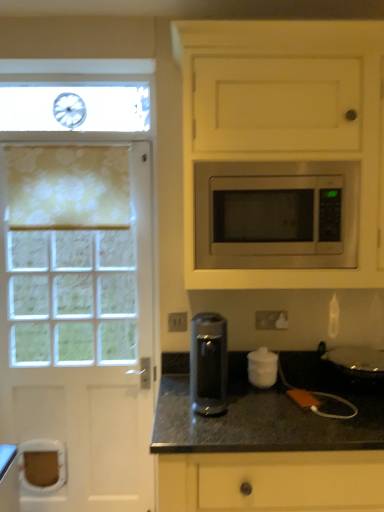
Question: From the image's perspective, is sleek metallic coffee maker at center on top of white matte sugar container at center?

Choices:
 (A) yes
 (B) no

Answer: (A)

Question: Considering the relative sizes of sleek metallic coffee maker at center and white matte sugar container at center in the image provided, is sleek metallic coffee maker at center taller than white matte sugar container at center?

Choices:
 (A) yes
 (B) no

Answer: (A)

Question: Is sleek metallic coffee maker at center with white matte sugar container at center?

Choices:
 (A) yes
 (B) no

Answer: (B)

Question: Is sleek metallic coffee maker at center thinner than white matte sugar container at center?

Choices:
 (A) yes
 (B) no

Answer: (B)

Question: Is sleek metallic coffee maker at center to the right of white matte sugar container at center from the viewer's perspective?

Choices:
 (A) no
 (B) yes

Answer: (A)

Question: From the image's perspective, is sleek metallic coffee maker at center positioned above or below satin silver microwave at upper right?

Choices:
 (A) above
 (B) below

Answer: (B)

Question: Based on their sizes in the image, would you say sleek metallic coffee maker at center is bigger or smaller than satin silver microwave at upper right?

Choices:
 (A) big
 (B) small

Answer: (B)

Question: From a real-world perspective, is sleek metallic coffee maker at center above or below satin silver microwave at upper right?

Choices:
 (A) above
 (B) below

Answer: (B)

Question: Would you say sleek metallic coffee maker at center is to the left or to the right of satin silver microwave at upper right in the picture?

Choices:
 (A) left
 (B) right

Answer: (A)

Question: Does point (11, 153) appear closer or farther from the camera than point (221, 184)?

Choices:
 (A) farther
 (B) closer

Answer: (A)

Question: Is yellow floral fabric at left taller or shorter than satin silver microwave at upper right?

Choices:
 (A) tall
 (B) short

Answer: (A)

Question: In terms of size, does yellow floral fabric at left appear bigger or smaller than satin silver microwave at upper right?

Choices:
 (A) big
 (B) small

Answer: (B)

Question: From the image's perspective, relative to satin silver microwave at upper right, is yellow floral fabric at left above or below?

Choices:
 (A) below
 (B) above

Answer: (B)

Question: In terms of size, does granite/black at lower center appear bigger or smaller than satin silver microwave at upper right?

Choices:
 (A) big
 (B) small

Answer: (A)

Question: Is granite/black at lower center taller or shorter than satin silver microwave at upper right?

Choices:
 (A) short
 (B) tall

Answer: (B)